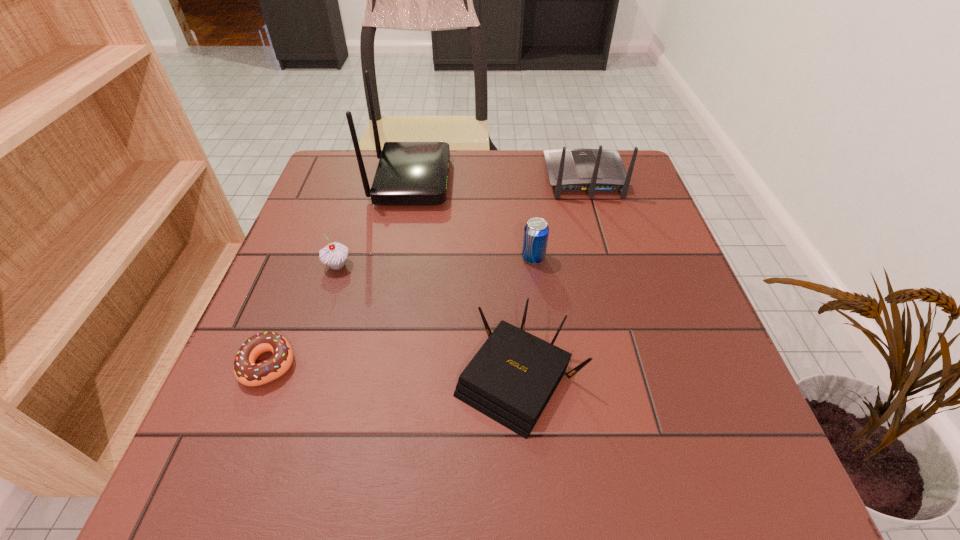
Identify the location of the tallest router. (409, 173).

Identify the location of the leftmost router. (409, 173).

You are a GUI agent. You are given a task and a screenshot of the screen. Output one action in this format:
    pyautogui.click(x=<x>, y=<y>)
    Task: Click on the second tallest router
    The image size is (960, 540).
    Given the screenshot: What is the action you would take?
    (x=570, y=170)

The image size is (960, 540). I want to click on the rightmost object, so click(x=570, y=170).

Identify the location of beer can. This screenshot has width=960, height=540. (536, 231).

This screenshot has height=540, width=960. In order to click on cupcake in this screenshot , I will do `click(334, 254)`.

This screenshot has width=960, height=540. I want to click on the nearest router, so click(x=512, y=377).

What are the coordinates of `the second router from left to right` in the screenshot? It's located at click(512, 377).

Identify the location of the shortest object. The width and height of the screenshot is (960, 540). (248, 373).

The image size is (960, 540). In order to click on vacant space positioned on the front-facing side of the tallest object in this screenshot , I will do `click(509, 181)`.